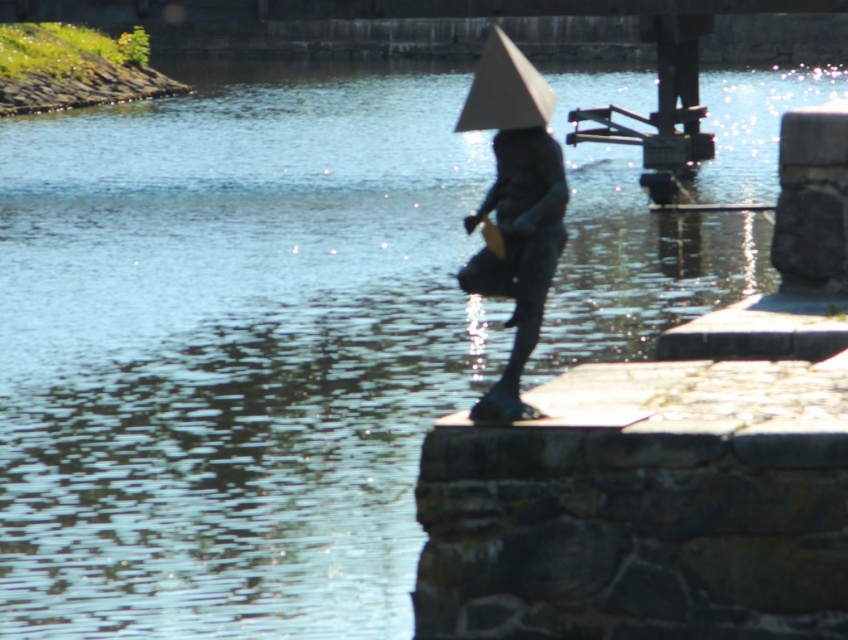
You are a tourist visiting the riverside and want to take a photo of the shiny bronze statue at center. However, there is a white paper umbrella at center blocking your view. Can you confirm if the statue is positioned below the umbrella?

The shiny bronze statue at center is below the white paper umbrella at center, so yes, the statue is positioned below the umbrella and might be partially obscured by it.

You are standing at the riverside and want to take a photo of the shiny bronze statue at center. If your camera has a maximum focus range of 10 meters, will you be able to capture the statue clearly?

The shiny bronze statue at center is 10.95 meters away from the viewer. Since the camera can only focus up to 10 meters, you won not be able to capture the statue clearly.

You are a tourist standing at the riverside and want to take a photo of both the shiny bronze statue at center and the white paper umbrella at center. Which object should you position to your left to include both in the frame?

The white paper umbrella at center should be positioned to your left since the shiny bronze statue at center is to the right of it, so placing the umbrella on your left will allow both to be captured in the photo.